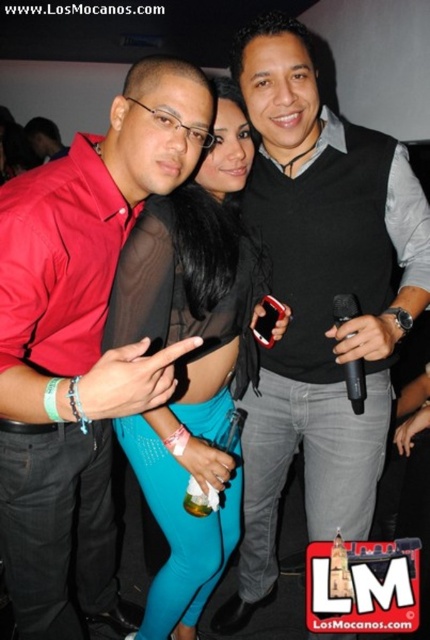
Between matte red shirt at center and satin black top at center, which one has less height?

With less height is matte red shirt at center.

Looking at this image, does matte red shirt at center appear under satin black top at center?

Yes, matte red shirt at center is below satin black top at center.

Where is `matte red shirt at center`? The width and height of the screenshot is (430, 640). matte red shirt at center is located at coordinates (80, 342).

Which of these two, satin black top at center or black plastic microphone at right, stands taller?

satin black top at center

Who is lower down, satin black top at center or black plastic microphone at right?

satin black top at center

This screenshot has height=640, width=430. What do you see at coordinates (190, 362) in the screenshot?
I see `satin black top at center` at bounding box center [190, 362].

Find the location of a particular element. This screenshot has width=430, height=640. satin black top at center is located at coordinates (190, 362).

Does point (258, 32) come behind point (362, 374)?

No, (258, 32) is closer to viewer.

From the picture: Which is below, black matte vest at center or black plastic microphone at right?

black matte vest at center is lower down.

Who is more distant from viewer, (356, 182) or (356, 310)?

The point (356, 182) is behind.

At what (x,y) coordinates should I click in order to perform the action: click on black matte vest at center. Please return your answer as a coordinate pair (x, y). Looking at the image, I should click on (319, 300).